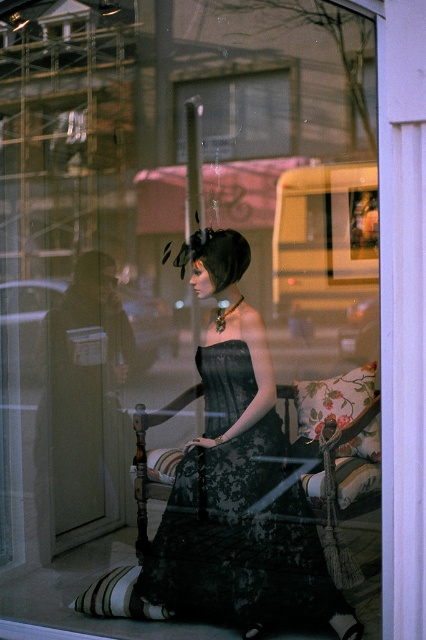
Is point (195, 554) closer to viewer compared to point (195, 86)?

That is True.

Who is positioned more to the right, black lace dress at center or transparent glass door at center?

Positioned to the right is black lace dress at center.

From the picture: Measure the distance between black lace dress at center and camera.

black lace dress at center and camera are 3.66 meters apart.

You are a GUI agent. You are given a task and a screenshot of the screen. Output one action in this format:
    pyautogui.click(x=<x>, y=<y>)
    Task: Click on the black lace dress at center
    The image size is (426, 640).
    Given the screenshot: What is the action you would take?
    pyautogui.click(x=236, y=541)